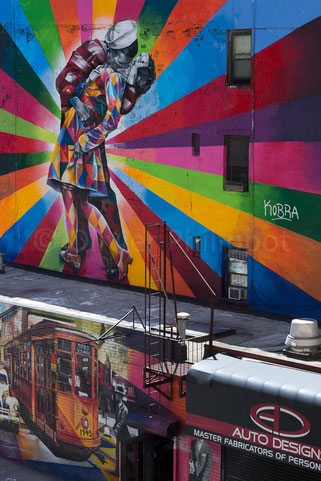
Find the location of a particular element. The width and height of the screenshot is (321, 481). windows is located at coordinates (238, 53), (234, 151).